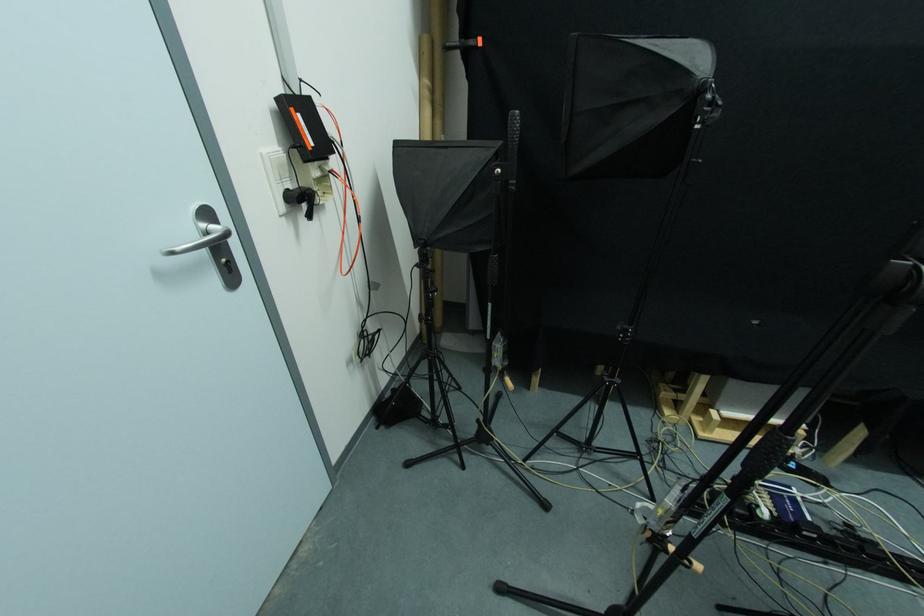
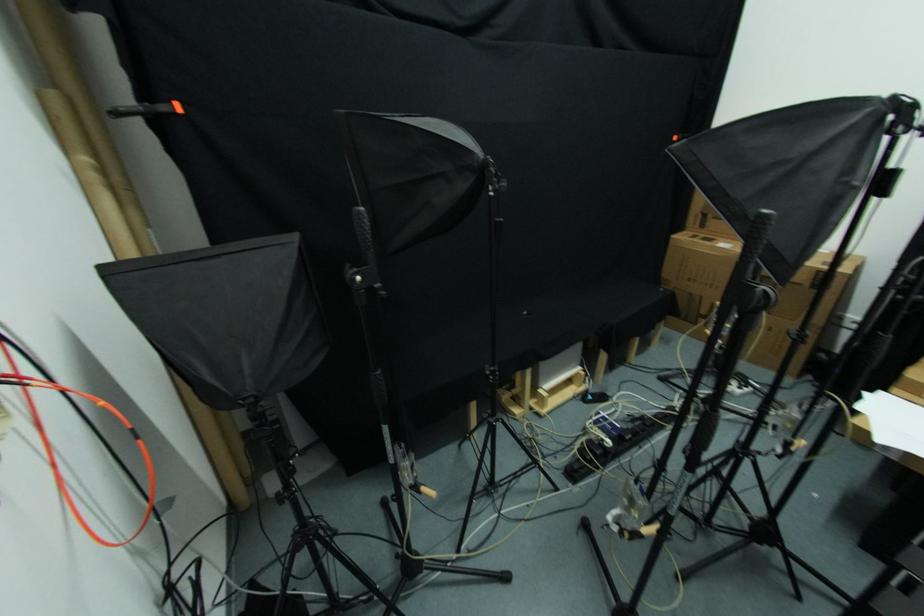
Question: How did the camera likely rotate?

Choices:
 (A) Left
 (B) Right
 (C) Up
 (D) Down

Answer: (B)